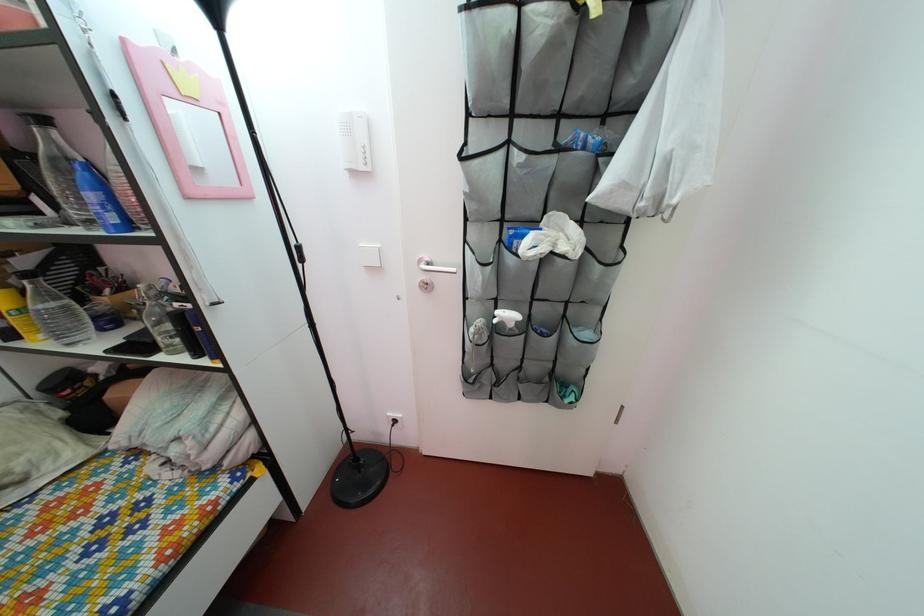
Where would you squeez the white spray bottle? Please return your answer as a coordinate pair (x, y).

(59, 168)